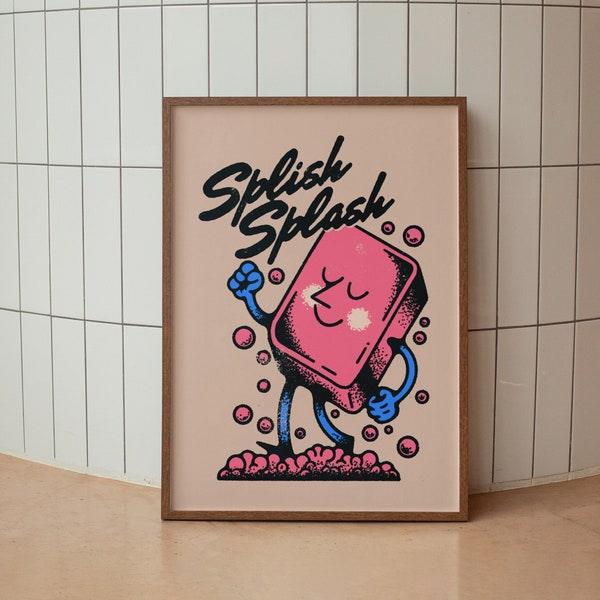
Where is `bar of soap`? This screenshot has width=600, height=600. bar of soap is located at coordinates (353, 253).